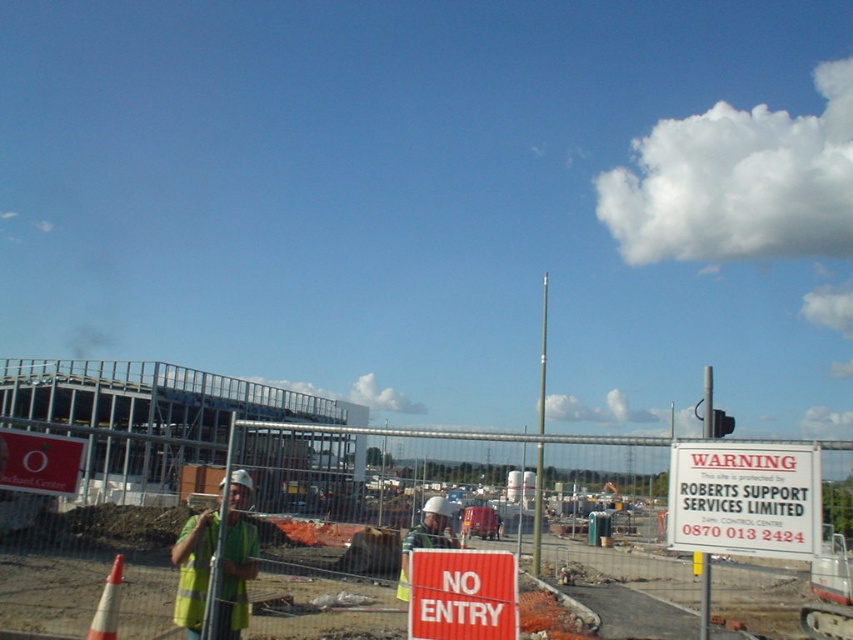
Between white plastic sign at upper left and reflective yellow vest at center, which one is positioned lower?

reflective yellow vest at center is lower down.

Is point (62, 436) more distant than point (404, 547)?

No, (62, 436) is closer to viewer.

Between point (50, 461) and point (434, 547), which one is positioned in front?

Point (50, 461) is in front.

Image resolution: width=853 pixels, height=640 pixels. Find the location of `white plastic sign at upper left`. white plastic sign at upper left is located at coordinates (39, 461).

Between metal fence at center and reflective yellow vest at center, which one appears on the right side from the viewer's perspective?

reflective yellow vest at center

Which is behind, point (73, 536) or point (438, 545)?

The point (73, 536) is more distant.

Which is in front, point (758, 509) or point (404, 600)?

Point (758, 509) is in front.

Where is `metal fence at center`? The width and height of the screenshot is (853, 640). metal fence at center is located at coordinates (286, 508).

Who is lower down, yellow reflective vest at center or reflective yellow vest at center?

reflective yellow vest at center is below.

Which is above, yellow reflective vest at center or reflective yellow vest at center?

Positioned higher is yellow reflective vest at center.

The image size is (853, 640). Describe the element at coordinates (236, 560) in the screenshot. I see `yellow reflective vest at center` at that location.

Identify the location of yellow reflective vest at center. The height and width of the screenshot is (640, 853). (236, 560).